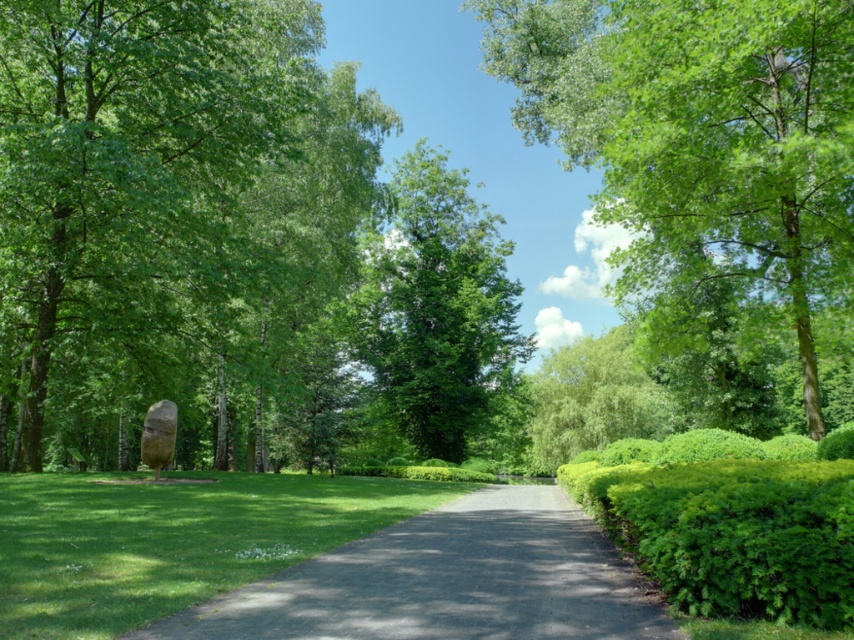
You are standing at the point labeled point (171, 540) in the park. What is the terrain like at that location?

The terrain at point (171, 540) is green grass at center.

You are a park visitor who wants to take a photo of the green leafy tree at upper center and the green leafy hedge at right. Which one should you step closer to in order to capture more details in your photo?

The green leafy tree at upper center has a larger width than the green leafy hedge at right, so you should step closer to the green leafy tree at upper center to capture more details in your photo.

You are a gardener who needs to water the green grass at center and the green leafy hedge at right. If your watering can holds enough water for 20 feet of distance, can you water both without needing to refill?

The green grass at center is 20.56 feet from the green leafy hedge at right. Since the distance between them is greater than the watering can capacity of 20 feet, you cannot water both without refilling.